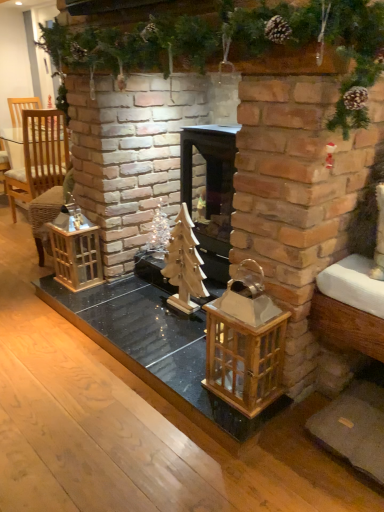
You are a GUI agent. You are given a task and a screenshot of the screen. Output one action in this format:
    pyautogui.click(x=<x>, y=<y>)
    Task: Click on the free space to the left of wooden christmas tree at center
    
    Given the screenshot: What is the action you would take?
    pyautogui.click(x=135, y=311)